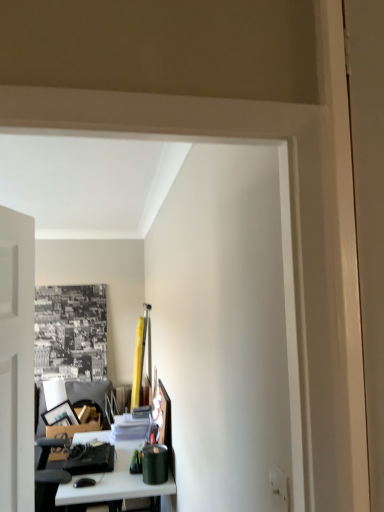
What do you see at coordinates (155, 464) in the screenshot?
I see `green matte canister at lower center, which is the second stationery from back to front` at bounding box center [155, 464].

Where is `white glossy table at lower left`? The height and width of the screenshot is (512, 384). white glossy table at lower left is located at coordinates (112, 477).

Could you tell me if matte black stationery at lower left, which is counted as the first stationery, starting from the back, is facing green matte canister at lower center, acting as the 2th stationery starting from the left?

No, matte black stationery at lower left, which is counted as the first stationery, starting from the back, does not turn towards green matte canister at lower center, acting as the 2th stationery starting from the left.

Can you tell me how much matte black stationery at lower left, arranged as the 1th stationery when viewed from the left, and green matte canister at lower center, acting as the 2th stationery starting from the left, differ in facing direction?

There is a 0.608-degree angle between the facing directions of matte black stationery at lower left, arranged as the 1th stationery when viewed from the left, and green matte canister at lower center, acting as the 2th stationery starting from the left.

Find the location of a particular element. The width and height of the screenshot is (384, 512). stationery below the green matte canister at lower center, the first stationery from the front (from a real-world perspective) is located at coordinates (90, 459).

Is matte black stationery at lower left, arranged as the 1th stationery when viewed from the left, with green matte canister at lower center, which is the second stationery from back to front?

No, matte black stationery at lower left, arranged as the 1th stationery when viewed from the left, is not beside green matte canister at lower center, which is the second stationery from back to front.

Is green matte canister at lower center, acting as the 2th stationery starting from the left, not inside matte black stationery at lower left, which is the 2th stationery in right-to-left order?

Absolutely, green matte canister at lower center, acting as the 2th stationery starting from the left, is external to matte black stationery at lower left, which is the 2th stationery in right-to-left order.

You are a GUI agent. You are given a task and a screenshot of the screen. Output one action in this format:
    pyautogui.click(x=<x>, y=<y>)
    Task: Click on the stationery lying on the left of green matte canister at lower center, which is the second stationery from back to front
    
    Given the screenshot: What is the action you would take?
    pyautogui.click(x=90, y=459)

Would you consider green matte canister at lower center, acting as the first stationery starting from the right, to be distant from matte black stationery at lower left, which is the 2th stationery in right-to-left order?

That's not correct — green matte canister at lower center, acting as the first stationery starting from the right, is a little close to matte black stationery at lower left, which is the 2th stationery in right-to-left order.

How far apart are green matte canister at lower center, acting as the first stationery starting from the right, and matte black stationery at lower left, arranged as the second stationery when viewed from the front?

A distance of 32.17 centimeters exists between green matte canister at lower center, acting as the first stationery starting from the right, and matte black stationery at lower left, arranged as the second stationery when viewed from the front.

Is green matte canister at lower center, acting as the 2th stationery starting from the left, aimed at white glossy table at lower left?

No, green matte canister at lower center, acting as the 2th stationery starting from the left, is not oriented towards white glossy table at lower left.

Between green matte canister at lower center, the first stationery from the front, and white glossy table at lower left, which one is positioned behind?

green matte canister at lower center, the first stationery from the front, is more distant.

Identify the location of stationery on the left of white glossy table at lower left. This screenshot has width=384, height=512. (90, 459).

From a real-world perspective, between matte black stationery at lower left, which is counted as the first stationery, starting from the back, and white glossy table at lower left, who is vertically higher?

In real-world perspective, matte black stationery at lower left, which is counted as the first stationery, starting from the back, is above.

From the image's perspective, is matte black stationery at lower left, arranged as the 1th stationery when viewed from the left, above or below white glossy table at lower left?

From the image's perspective, matte black stationery at lower left, arranged as the 1th stationery when viewed from the left, appears above white glossy table at lower left.

Looking at this image, which is more to the right, white glossy table at lower left or matte black stationery at lower left, which is counted as the first stationery, starting from the back?

white glossy table at lower left is more to the right.

Does white glossy table at lower left have a lesser width compared to matte black stationery at lower left, arranged as the second stationery when viewed from the front?

No, white glossy table at lower left is not thinner than matte black stationery at lower left, arranged as the second stationery when viewed from the front.

Is white glossy table at lower left located outside matte black stationery at lower left, which is counted as the first stationery, starting from the back?

Absolutely, white glossy table at lower left is external to matte black stationery at lower left, which is counted as the first stationery, starting from the back.

Can you tell me how much white glossy table at lower left and matte black stationery at lower left, which is counted as the first stationery, starting from the back, differ in facing direction?

The facing directions of white glossy table at lower left and matte black stationery at lower left, which is counted as the first stationery, starting from the back, are 0.45 degrees apart.

Is white glossy table at lower left wider or thinner than green matte canister at lower center, the first stationery from the front?

In the image, white glossy table at lower left appears to be wider than green matte canister at lower center, the first stationery from the front.

Is point (60, 489) in front of point (165, 473)?

Yes.

This screenshot has height=512, width=384. Find the location of `the 2nd stationery directly above the white glossy table at lower left (from a real-world perspective)`. the 2nd stationery directly above the white glossy table at lower left (from a real-world perspective) is located at coordinates (155, 464).

Locate an element on the screen. stationery on the right of matte black stationery at lower left, which is counted as the first stationery, starting from the back is located at coordinates (155, 464).

You are a GUI agent. You are given a task and a screenshot of the screen. Output one action in this format:
    pyautogui.click(x=<x>, y=<y>)
    Task: Click on the stationery above the matte black stationery at lower left, which is the 2th stationery in right-to-left order (from a real-world perspective)
    
    Given the screenshot: What is the action you would take?
    pyautogui.click(x=155, y=464)

Which object lies nearer to the anchor point matte black stationery at lower left, arranged as the second stationery when viewed from the front, white glossy table at lower left or green matte canister at lower center, which is the second stationery from back to front?

white glossy table at lower left lies closer to matte black stationery at lower left, arranged as the second stationery when viewed from the front, than the other object.

Which object lies nearer to the anchor point matte black stationery at lower left, arranged as the 1th stationery when viewed from the left, green matte canister at lower center, the first stationery from the front, or white glossy table at lower left?

white glossy table at lower left is positioned closer to the anchor matte black stationery at lower left, arranged as the 1th stationery when viewed from the left.

Considering their positions, is green matte canister at lower center, which is the second stationery from back to front, positioned closer to white glossy table at lower left than matte black stationery at lower left, arranged as the second stationery when viewed from the front?

matte black stationery at lower left, arranged as the second stationery when viewed from the front, is closer to white glossy table at lower left.

Considering their positions, is matte black stationery at lower left, arranged as the 1th stationery when viewed from the left, positioned further to white glossy table at lower left than green matte canister at lower center, the first stationery from the front?

green matte canister at lower center, the first stationery from the front, is positioned further to the anchor white glossy table at lower left.

When comparing their distances from green matte canister at lower center, acting as the 2th stationery starting from the left, does white glossy table at lower left or matte black stationery at lower left, arranged as the 1th stationery when viewed from the left, seem closer?

white glossy table at lower left lies closer to green matte canister at lower center, acting as the 2th stationery starting from the left, than the other object.

Considering their positions, is matte black stationery at lower left, arranged as the 1th stationery when viewed from the left, positioned further to green matte canister at lower center, acting as the 2th stationery starting from the left, than white glossy table at lower left?

The object further to green matte canister at lower center, acting as the 2th stationery starting from the left, is matte black stationery at lower left, arranged as the 1th stationery when viewed from the left.

Identify the location of stationery between green matte canister at lower center, acting as the 2th stationery starting from the left, and white glossy table at lower left, in the vertical direction. Image resolution: width=384 pixels, height=512 pixels. (90, 459).